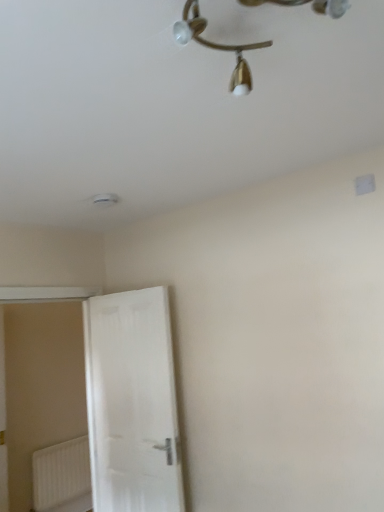
Question: Considering the relative sizes of white matte door at left and gold metallic chandelier at upper center in the image provided, is white matte door at left bigger than gold metallic chandelier at upper center?

Choices:
 (A) no
 (B) yes

Answer: (B)

Question: From the image's perspective, is white matte door at left located above gold metallic chandelier at upper center?

Choices:
 (A) yes
 (B) no

Answer: (B)

Question: Is gold metallic chandelier at upper center a part of white matte door at left?

Choices:
 (A) yes
 (B) no

Answer: (B)

Question: Is white matte door at left placed right next to gold metallic chandelier at upper center?

Choices:
 (A) yes
 (B) no

Answer: (B)

Question: Can you confirm if white matte door at left is shorter than gold metallic chandelier at upper center?

Choices:
 (A) no
 (B) yes

Answer: (A)

Question: Would you say white matte door at left is to the left or to the right of white plastic radiator at lower left in the picture?

Choices:
 (A) right
 (B) left

Answer: (A)

Question: Is point (142, 458) closer or farther from the camera than point (79, 486)?

Choices:
 (A) closer
 (B) farther

Answer: (A)

Question: From the image's perspective, is white matte door at left located above or below white plastic radiator at lower left?

Choices:
 (A) below
 (B) above

Answer: (B)

Question: Is white matte door at left inside the boundaries of white plastic radiator at lower left, or outside?

Choices:
 (A) inside
 (B) outside

Answer: (B)

Question: In the image, is gold metallic chandelier at upper center positioned in front of or behind white plastic radiator at lower left?

Choices:
 (A) behind
 (B) front

Answer: (B)

Question: Considering the relative positions of gold metallic chandelier at upper center and white plastic radiator at lower left in the image provided, is gold metallic chandelier at upper center to the left or to the right of white plastic radiator at lower left?

Choices:
 (A) right
 (B) left

Answer: (A)

Question: Does point (249, 47) appear closer or farther from the camera than point (34, 477)?

Choices:
 (A) closer
 (B) farther

Answer: (A)

Question: From the image's perspective, relative to white plastic radiator at lower left, is gold metallic chandelier at upper center above or below?

Choices:
 (A) below
 (B) above

Answer: (B)

Question: From their relative heights in the image, would you say white matte door at left is taller or shorter than gold metallic chandelier at upper center?

Choices:
 (A) short
 (B) tall

Answer: (B)

Question: From the image's perspective, relative to gold metallic chandelier at upper center, is white matte door at left above or below?

Choices:
 (A) above
 (B) below

Answer: (B)